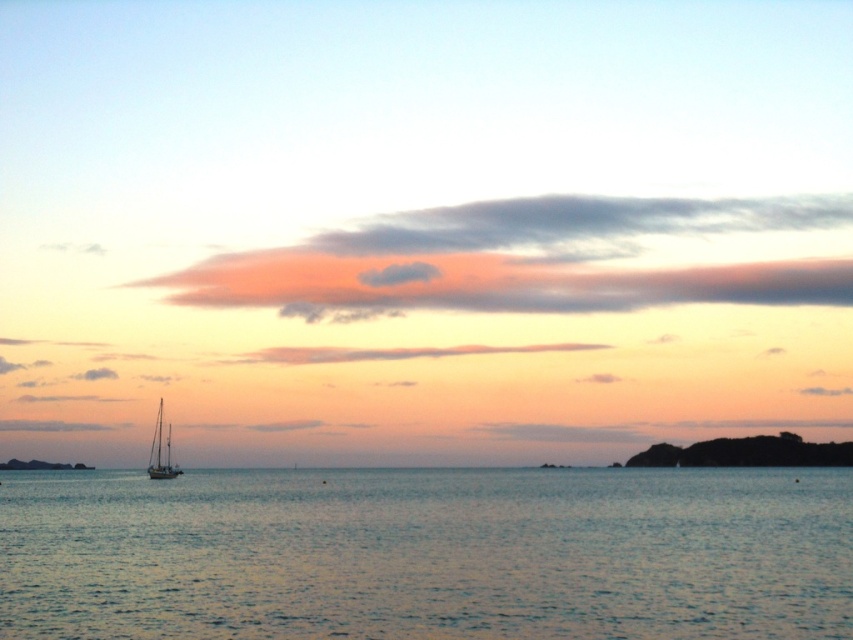
You are standing on the beach looking at the scene. You see the blue water at center and the white matte sailboat at lower left. How far apart are these two objects from each other?

The blue water at center is 43.36 meters away from the white matte sailboat at lower left.

You are standing at the edge of the sea in the image and want to walk towards the point labeled point (320, 580). Will you pass by point (157, 435) before reaching your destination?

Yes, you will pass by point (157, 435) before reaching point (320, 580) because point (320, 580) is in front of point (157, 435), meaning it is closer to your current position.

You are an artist planning to paint the seascape scene. You want to ensure the white matte sailboat at lower left is proportionally smaller than the blue water at center in your painting. Does the current scene allow this?

Yes, the blue water at center is bigger than the white matte sailboat at lower left, so the sailboat can be painted proportionally smaller as desired.